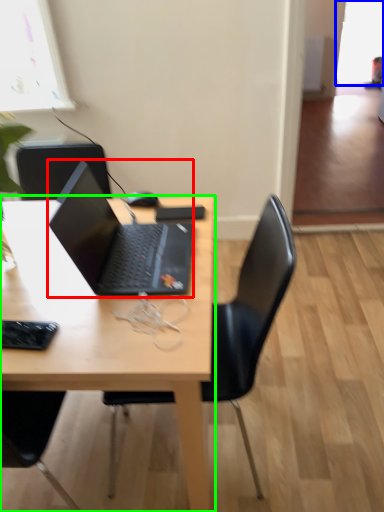
Question: Estimate the real-world distances between objects in this image. Which object is closer to laptop (highlighted by a red box), window screen (highlighted by a blue box) or desk (highlighted by a green box)?

Choices:
 (A) window screen
 (B) desk

Answer: (B)